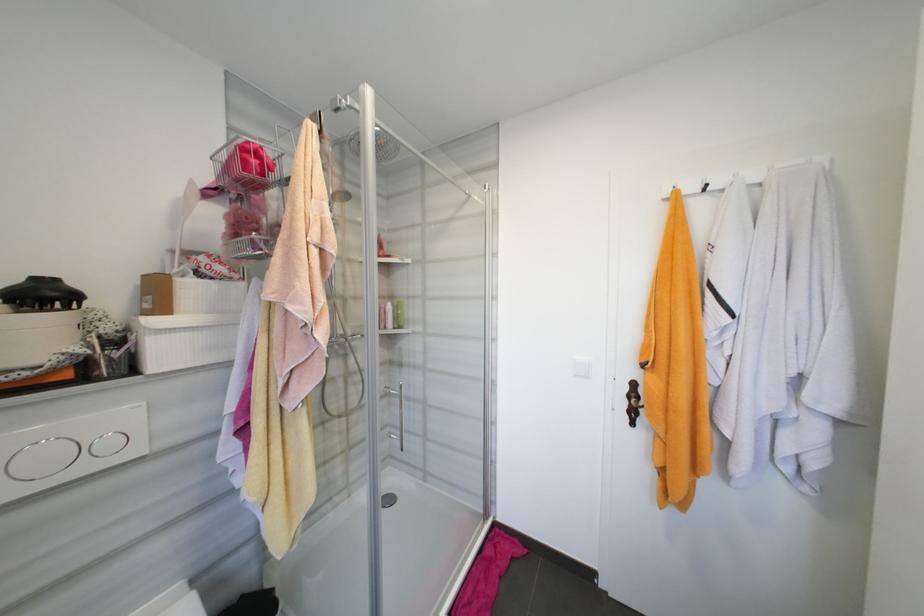
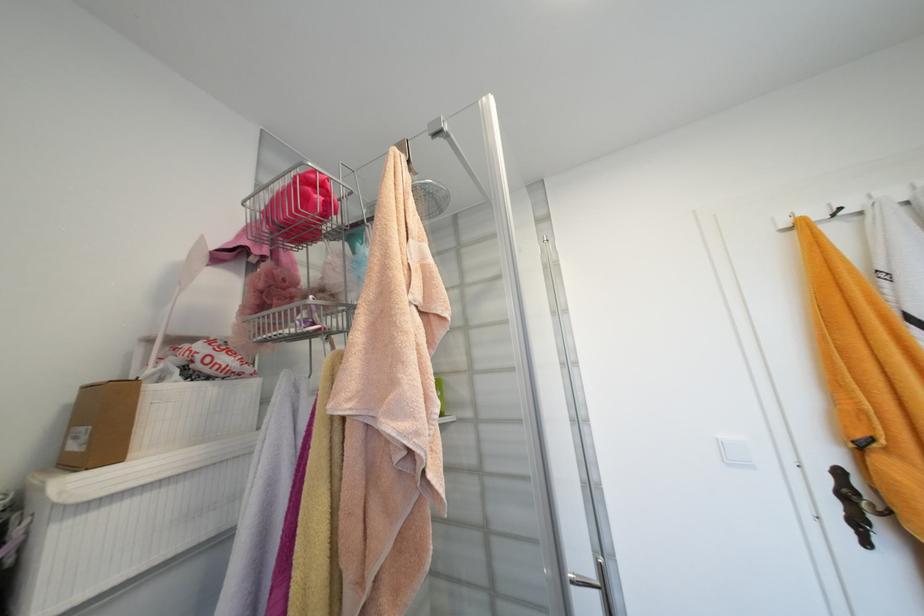
Which direction would the cameraman need to move to produce the second image?

The movement direction of the cameraman is left, forward.